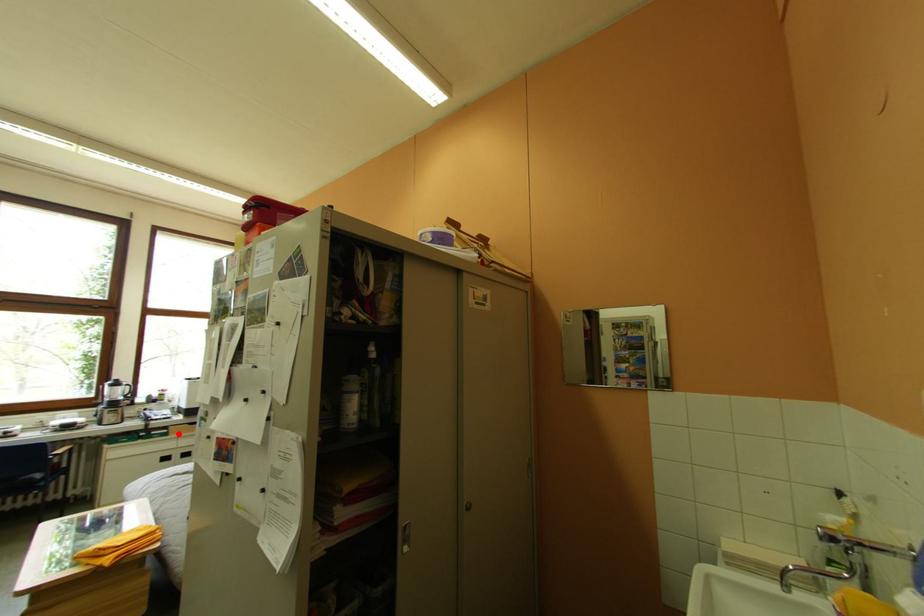
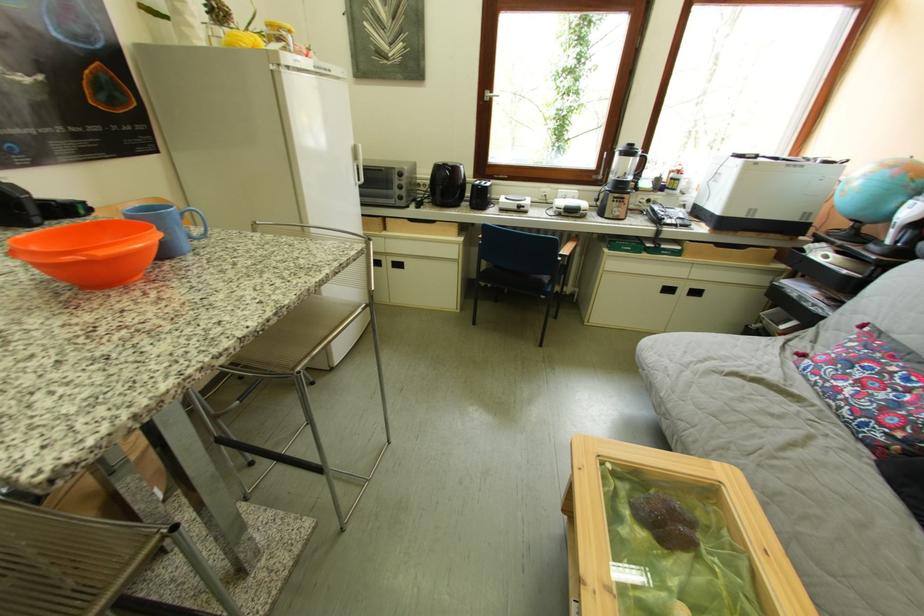
Locate, in the second image, the point that corresponds to the highlighted location in the first image.

(690, 251)